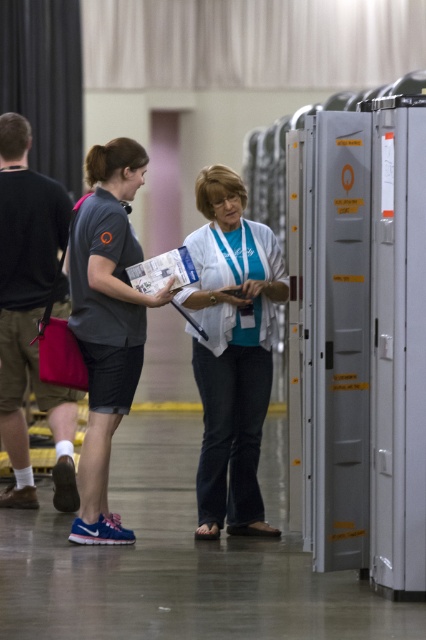
Which is more to the right, white matte shirt at center or matte gray shirt at center?

From the viewer's perspective, white matte shirt at center appears more on the right side.

Looking at this image, can you confirm if white matte shirt at center is taller than matte gray shirt at center?

Incorrect, white matte shirt at center's height is not larger of matte gray shirt at center's.

Find the location of `white matte shirt at center`. white matte shirt at center is located at coordinates (232, 349).

Is matte gray shirt at center bigger than dark brown leather shoes at left?

Yes.

Who is positioned more to the left, matte gray shirt at center or dark brown leather shoes at left?

dark brown leather shoes at left

This screenshot has height=640, width=426. What do you see at coordinates (106, 323) in the screenshot?
I see `matte gray shirt at center` at bounding box center [106, 323].

In order to click on matte gray shirt at center in this screenshot , I will do `click(106, 323)`.

Consider the image. Is white matte shirt at center wider than dark brown leather shoes at left?

Yes.

Can you confirm if white matte shirt at center is taller than dark brown leather shoes at left?

Incorrect, white matte shirt at center's height is not larger of dark brown leather shoes at left's.

What do you see at coordinates (232, 349) in the screenshot? This screenshot has width=426, height=640. I see `white matte shirt at center` at bounding box center [232, 349].

Where is `white matte shirt at center`? Image resolution: width=426 pixels, height=640 pixels. white matte shirt at center is located at coordinates (232, 349).